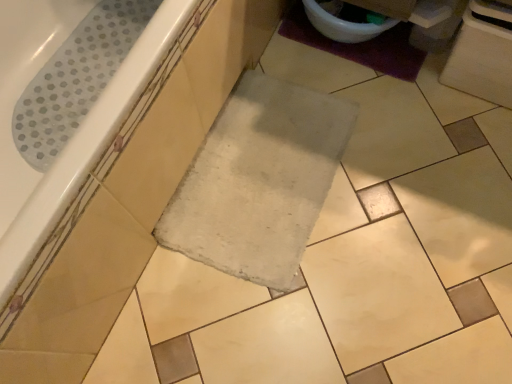
Locate an element on the screen. free location in front of purple fuzzy bath mat at upper right is located at coordinates (389, 114).